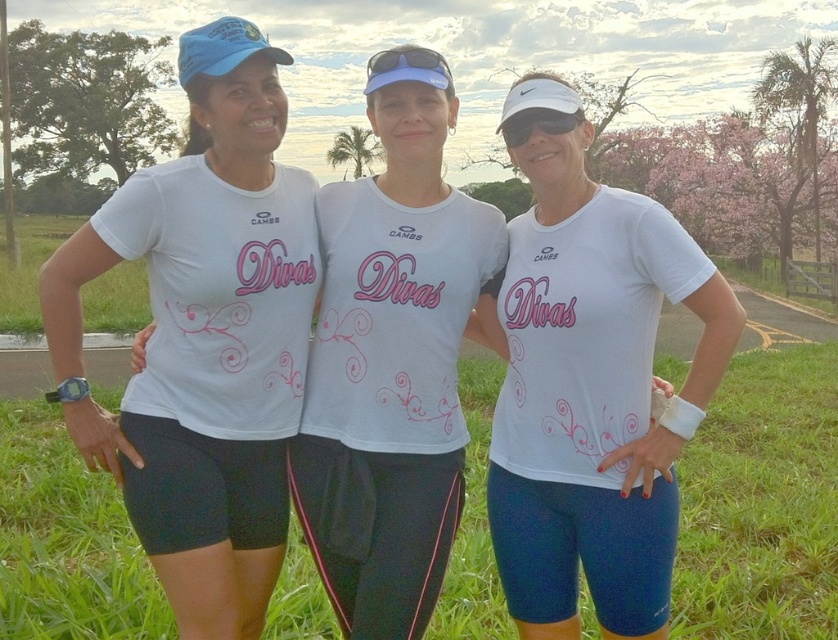
Question: Which point is closer to the camera taking this photo?

Choices:
 (A) (671, 419)
 (B) (106, 422)

Answer: (A)

Question: Which point is closer to the camera?

Choices:
 (A) white matte t-shirt at center
 (B) white matte t-shirt at left

Answer: (A)

Question: Can you confirm if white matte t-shirt at left is wider than white matte t-shirt at center?

Choices:
 (A) no
 (B) yes

Answer: (B)

Question: Can you confirm if white matte t-shirt at left is positioned to the left of white matte t-shirt at center?

Choices:
 (A) yes
 (B) no

Answer: (A)

Question: Can you confirm if white matte t-shirt at left is smaller than white matte t-shirt at center?

Choices:
 (A) yes
 (B) no

Answer: (B)

Question: Which point is closer to the camera taking this photo?

Choices:
 (A) (120, 225)
 (B) (624, 422)

Answer: (A)